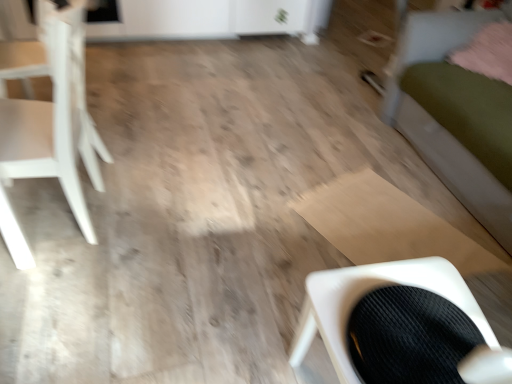
At what (x,y) coordinates should I click in order to perform the action: click on vacant space to the right of white matte chair at left, acting as the 2th chair starting from the right. Please return your answer as a coordinate pair (x, y). This screenshot has width=512, height=384. Looking at the image, I should click on (162, 226).